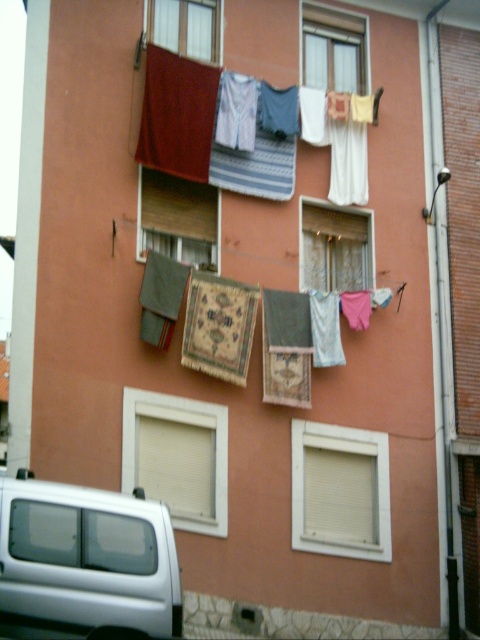
You are standing at the base of the residential building and want to look through the white matte window at lower center. Considering your height is 5 feet 8 inches, can you see through the window without using any tools?

The white matte window at lower center is 76.40 feet from viewer, which is much higher than your height of 5 feet 8 inches. You cannot see through the window without using a ladder or other tool to reach that height.

You are a window installer assessing the building. You need to replace the glass on the white matte window at lower left and the matte glass window at upper center. Which window requires a larger glass pane?

The white matte window at lower left requires a larger glass pane since it is larger in size than the matte glass window at upper center.

Consider the image. You are a delivery driver who needs to park your silver metallic van at lower left in a spot that is just as wide as the white fabric at center. Can you fit your van into that spot?

The silver metallic van at lower left is bigger than the white fabric at center, so it cannot fit into a parking spot that is the same size as the white fabric at center.